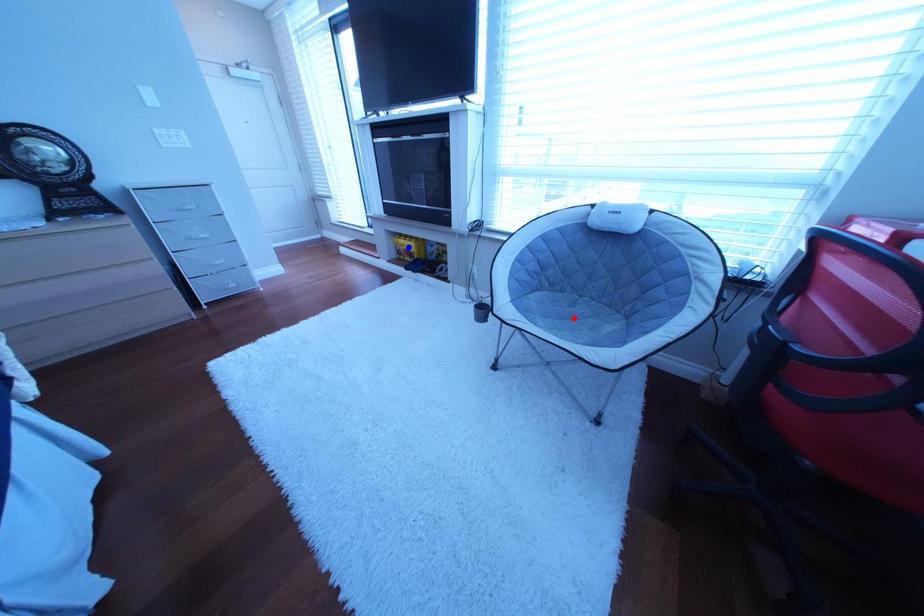
Question: Which of the two points in the image is closer to the camera?

Choices:
 (A) Blue point is closer.
 (B) Red point is closer.

Answer: (B)